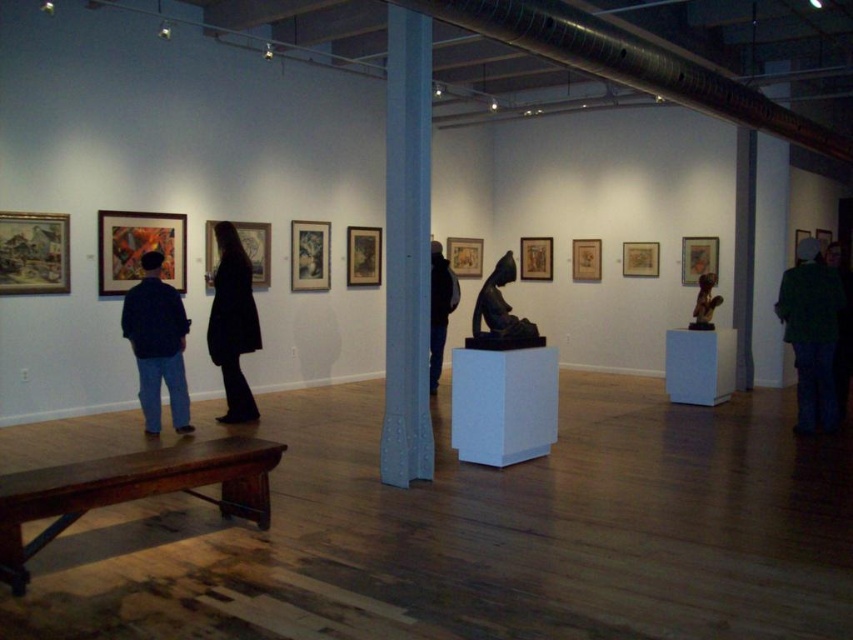
Question: Is blue painted metal column at center smaller than dark blue jeans at left?

Choices:
 (A) yes
 (B) no

Answer: (B)

Question: Based on their relative distances, which object is nearer to the dark blue jeans at left?

Choices:
 (A) dark brown polished wood statue at center
 (B) bronze statue at center
 (C) blue painted metal column at center

Answer: (C)

Question: Is green fuzzy coat at right in front of dark brown polished wood statue at center?

Choices:
 (A) yes
 (B) no

Answer: (B)

Question: Which point is farther from the camera taking this photo?

Choices:
 (A) (390, 13)
 (B) (813, 403)
 (C) (236, 307)
 (D) (711, 328)

Answer: (D)

Question: Which object is farther from the camera taking this photo?

Choices:
 (A) dark brown polished wood statue at center
 (B) bronze statue at center
 (C) dark blue jeans at left

Answer: (B)

Question: Is dark brown polished wood statue at center above bronze statue at center?

Choices:
 (A) yes
 (B) no

Answer: (B)